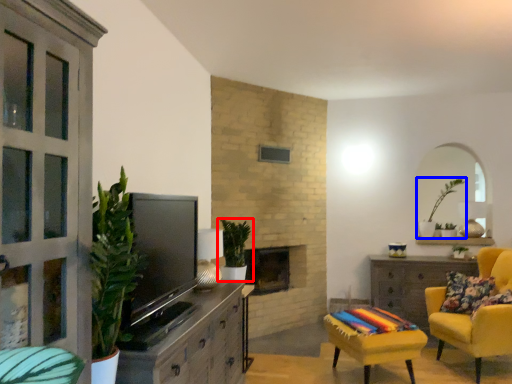
Question: Which of the following is the farthest to the observer, houseplant (highlighted by a red box) or houseplant (highlighted by a blue box)?

Choices:
 (A) houseplant
 (B) houseplant

Answer: (B)